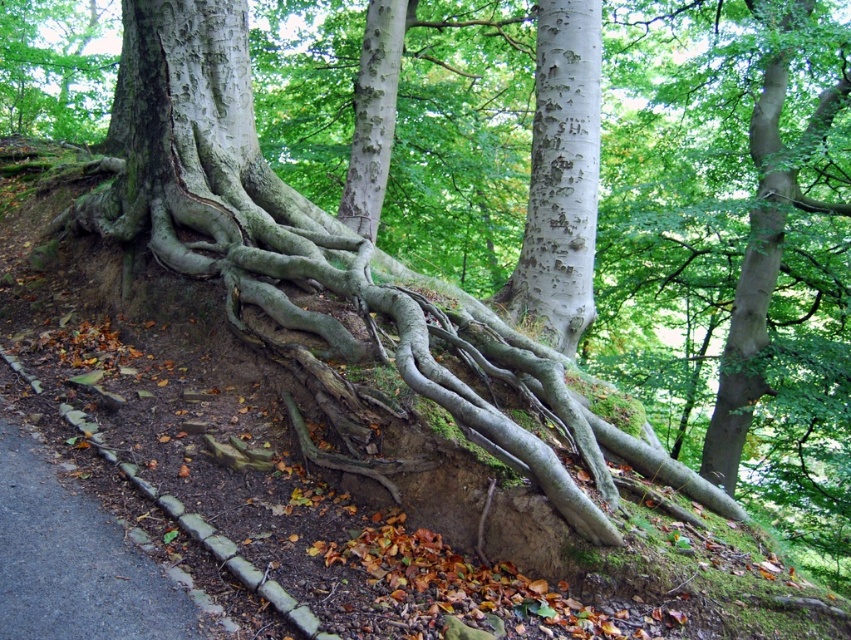
Question: Among these objects, which one is farthest from the camera?

Choices:
 (A) brown stone curb at lower left
 (B) smooth gray roots at upper left
 (C) white speckled bark at center
 (D) smooth white bark at center

Answer: (B)

Question: In this image, where is white speckled bark at center located relative to smooth white bark at center?

Choices:
 (A) above
 (B) below

Answer: (B)

Question: Does white speckled bark at center have a greater width compared to smooth gray roots at upper left?

Choices:
 (A) yes
 (B) no

Answer: (A)

Question: Which of the following is the farthest from the observer?

Choices:
 (A) white speckled bark at center
 (B) smooth gray roots at upper left
 (C) smooth white bark at center

Answer: (B)

Question: Can you confirm if white speckled bark at center is positioned below brown stone curb at lower left?

Choices:
 (A) yes
 (B) no

Answer: (B)

Question: Estimate the real-world distances between objects in this image. Which object is farther from the brown stone curb at lower left?

Choices:
 (A) white speckled bark at center
 (B) smooth white bark at center
 (C) smooth gray roots at upper left

Answer: (C)